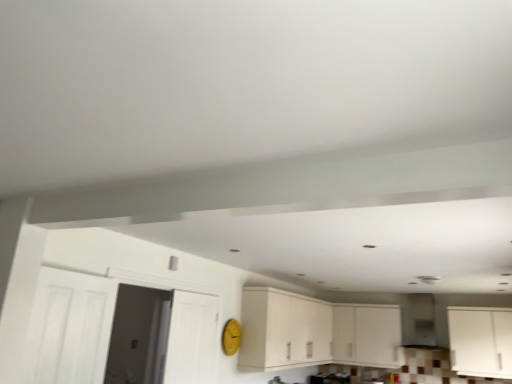
Question: Considering the relative positions of white matte door at left, the 3th door from the back, and white matte cabinet at center, positioned as the second cabinetry in left-to-right order, in the image provided, is white matte door at left, the 3th door from the back, behind white matte cabinet at center, positioned as the second cabinetry in left-to-right order,?

Choices:
 (A) no
 (B) yes

Answer: (A)

Question: Would you say white matte door at left, the first door in the front-to-back sequence, contains white matte cabinet at center, positioned as the second cabinetry in left-to-right order?

Choices:
 (A) yes
 (B) no

Answer: (B)

Question: Is white matte door at left, the first door in the front-to-back sequence, not near white matte cabinet at center, acting as the second cabinetry starting from the right?

Choices:
 (A) no
 (B) yes

Answer: (B)

Question: Is white matte door at left, the 3th door from the back, at the right side of white matte cabinet at center, positioned as the second cabinetry in left-to-right order?

Choices:
 (A) no
 (B) yes

Answer: (A)

Question: From a real-world perspective, is white matte door at left, the first door in the front-to-back sequence, on white matte cabinet at center, acting as the second cabinetry starting from the right?

Choices:
 (A) no
 (B) yes

Answer: (A)

Question: Does white matte door at left, the first door in the front-to-back sequence, have a greater height compared to white matte cabinet at center, acting as the second cabinetry starting from the right?

Choices:
 (A) yes
 (B) no

Answer: (B)

Question: Is white matte cabinet at right, acting as the third cabinetry starting from the left, to the left of white wooden door at left, the second door viewed from the front, from the viewer's perspective?

Choices:
 (A) no
 (B) yes

Answer: (A)

Question: Is white matte cabinet at right, acting as the third cabinetry starting from the left, not close to white wooden door at left, the second door viewed from the front?

Choices:
 (A) yes
 (B) no

Answer: (A)

Question: From a real-world perspective, does white matte cabinet at right, the 1th cabinetry positioned from the right, sit lower than white wooden door at left, the second door viewed from the front?

Choices:
 (A) no
 (B) yes

Answer: (A)

Question: Would you say white matte cabinet at right, the 1th cabinetry positioned from the right, contains white wooden door at left, which is counted as the second door, starting from the back?

Choices:
 (A) no
 (B) yes

Answer: (A)

Question: Can you confirm if white matte cabinet at right, acting as the third cabinetry starting from the left, is taller than white wooden door at left, which is counted as the second door, starting from the back?

Choices:
 (A) no
 (B) yes

Answer: (A)

Question: Is white matte cabinet at right, acting as the third cabinetry starting from the left, smaller than white wooden door at left, the second door viewed from the front?

Choices:
 (A) yes
 (B) no

Answer: (A)

Question: Considering the relative sizes of white matte cabinet at center, acting as the second cabinetry starting from the right, and white wooden door at left, which is counted as the second door, starting from the back, in the image provided, is white matte cabinet at center, acting as the second cabinetry starting from the right, bigger than white wooden door at left, which is counted as the second door, starting from the back,?

Choices:
 (A) yes
 (B) no

Answer: (A)